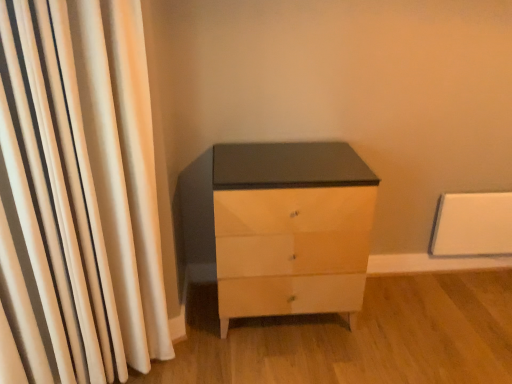
At what (x,y) coordinates should I click in order to perform the action: click on vacant area located to the right-hand side of matte white chest of drawers at center. Please return your answer as a coordinate pair (x, y). The width and height of the screenshot is (512, 384). Looking at the image, I should click on (396, 321).